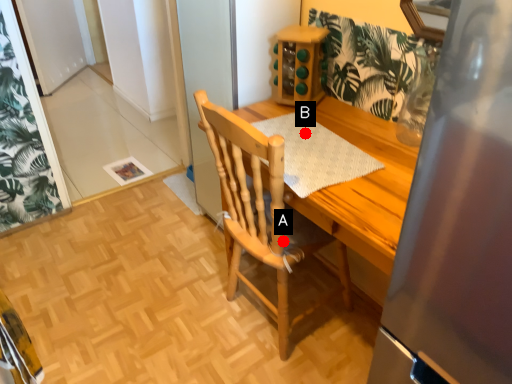
Question: Two points are circled on the image, labeled by A and B beside each circle. Which point appears closest to the camera in this image?

Choices:
 (A) A is closer
 (B) B is closer

Answer: (A)